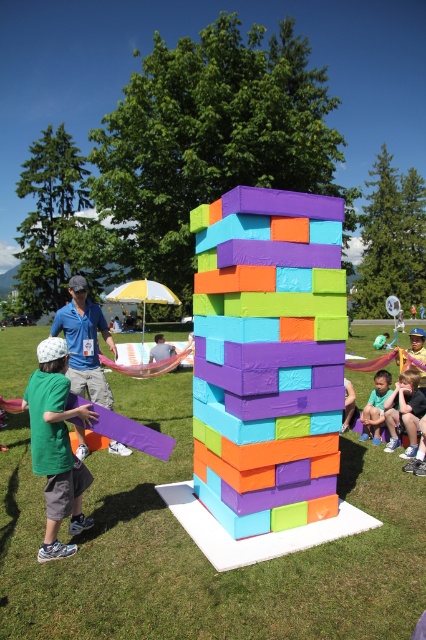
Who is positioned more to the left, light blue fabric at center or matte blue shorts at lower right?

light blue fabric at center is more to the left.

Which is behind, point (149, 356) or point (386, 346)?

The point (386, 346) is behind.

Image resolution: width=426 pixels, height=640 pixels. Describe the element at coordinates (161, 349) in the screenshot. I see `light blue fabric at center` at that location.

This screenshot has height=640, width=426. I want to click on light blue fabric at center, so click(x=161, y=349).

Between matte plastic blocks at center and smooth skin child at lower right, which one has less height?

Standing shorter between the two is smooth skin child at lower right.

What do you see at coordinates (267, 355) in the screenshot? I see `matte plastic blocks at center` at bounding box center [267, 355].

The image size is (426, 640). I want to click on matte plastic blocks at center, so click(267, 355).

In the scene shown: Which is more to the right, matte plastic blocks at center or light blue fabric at center?

matte plastic blocks at center

Who is positioned more to the left, matte plastic blocks at center or light blue fabric at center?

light blue fabric at center

You are a GUI agent. You are given a task and a screenshot of the screen. Output one action in this format:
    pyautogui.click(x=<x>, y=<y>)
    Task: Click on the matte plastic blocks at center
    This screenshot has height=640, width=426.
    Given the screenshot: What is the action you would take?
    pyautogui.click(x=267, y=355)